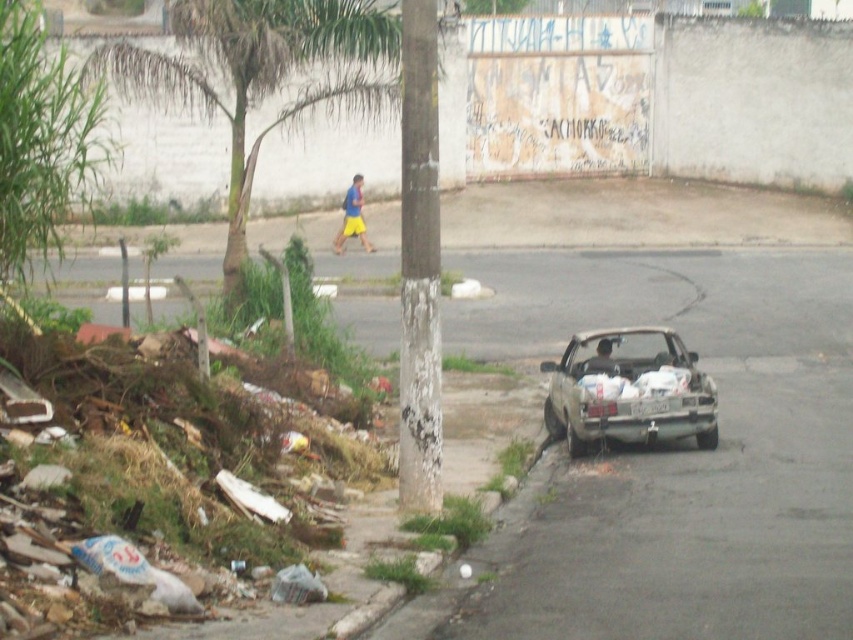
Measure the distance between silver metallic car at lower right and blue/yellow shorts at center.

silver metallic car at lower right is 56.57 feet from blue/yellow shorts at center.

What do you see at coordinates (630, 388) in the screenshot? I see `silver metallic car at lower right` at bounding box center [630, 388].

Between point (637, 388) and point (343, 216), which one is positioned in front?

Positioned in front is point (637, 388).

Find the location of a particular element. silver metallic car at lower right is located at coordinates (630, 388).

Can you confirm if blue/yellow shorts at center is wider than dark brown leather jacket at center?

Yes, blue/yellow shorts at center is wider than dark brown leather jacket at center.

Identify the location of blue/yellow shorts at center. (352, 216).

In the scene shown: Who is more forward, (32,124) or (614,369)?

Positioned in front is point (32,124).

The height and width of the screenshot is (640, 853). What do you see at coordinates (41, 140) in the screenshot? I see `green leafy tree at left` at bounding box center [41, 140].

Identify the location of green leafy tree at left. The width and height of the screenshot is (853, 640). (41, 140).